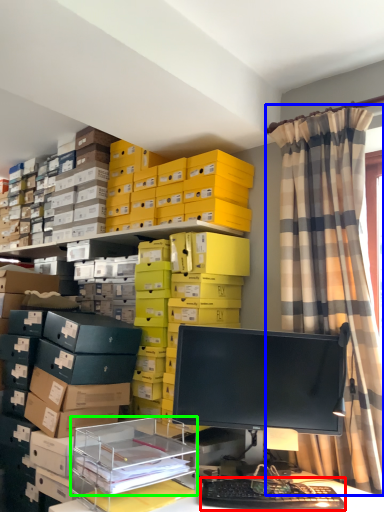
Question: Based on their relative distances, which object is nearer to computer keyboard (highlighted by a red box)? Choose from curtain (highlighted by a blue box) and shelf (highlighted by a green box).

Choices:
 (A) curtain
 (B) shelf

Answer: (B)